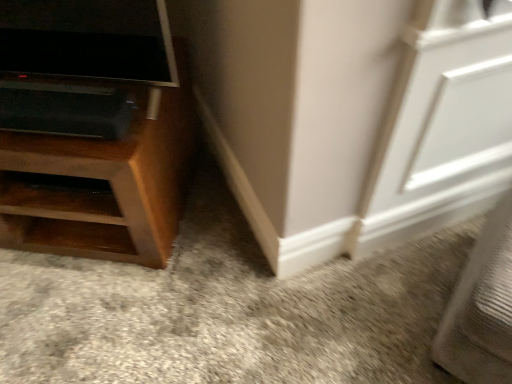
You are a GUI agent. You are given a task and a screenshot of the screen. Output one action in this format:
    pyautogui.click(x=<x>, y=<y>)
    Task: Click on the white matte screen door at upper right
    The height and width of the screenshot is (384, 512).
    Given the screenshot: What is the action you would take?
    pyautogui.click(x=442, y=126)

This screenshot has height=384, width=512. What do you see at coordinates (442, 126) in the screenshot? I see `white matte screen door at upper right` at bounding box center [442, 126].

This screenshot has width=512, height=384. What do you see at coordinates (103, 183) in the screenshot?
I see `wooden cabinet at left` at bounding box center [103, 183].

From the picture: Measure the distance between point (19, 133) and camera.

Point (19, 133) and camera are 3.48 feet apart from each other.

You are a GUI agent. You are given a task and a screenshot of the screen. Output one action in this format:
    pyautogui.click(x=<x>, y=<y>)
    Task: Click on the wooden cabinet at left
    This screenshot has height=384, width=512.
    Given the screenshot: What is the action you would take?
    pyautogui.click(x=103, y=183)

Identify the location of white matte screen door at upper right. The width and height of the screenshot is (512, 384). (442, 126).

Considering the relative positions of wooden cabinet at left and white matte screen door at upper right in the image provided, is wooden cabinet at left to the left of white matte screen door at upper right from the viewer's perspective?

Indeed, wooden cabinet at left is positioned on the left side of white matte screen door at upper right.

Is wooden cabinet at left in front of white matte screen door at upper right?

No, it is not.

Which is behind, point (143, 115) or point (422, 171)?

Positioned behind is point (422, 171).

From the image's perspective, is wooden cabinet at left located above or below white matte screen door at upper right?

wooden cabinet at left is situated higher than white matte screen door at upper right in the image.

From a real-world perspective, which is physically below, wooden cabinet at left or white matte screen door at upper right?

In real-world perspective, wooden cabinet at left is lower.

In terms of width, does wooden cabinet at left look wider or thinner when compared to white matte screen door at upper right?

Considering their sizes, wooden cabinet at left looks broader than white matte screen door at upper right.

Which of these two, wooden cabinet at left or white matte screen door at upper right, stands shorter?

Standing shorter between the two is wooden cabinet at left.

Who is bigger, wooden cabinet at left or white matte screen door at upper right?

With larger size is wooden cabinet at left.

Is white matte screen door at upper right a part of wooden cabinet at left?

No.

Is wooden cabinet at left far away from white matte screen door at upper right?

No, wooden cabinet at left is not far away from white matte screen door at upper right.

Consider the image. Does wooden cabinet at left turn towards white matte screen door at upper right?

No, wooden cabinet at left is not turned towards white matte screen door at upper right.

Where is `screen door on the right of wooden cabinet at left`? The image size is (512, 384). screen door on the right of wooden cabinet at left is located at coordinates (442, 126).

Which object is positioned more to the left, white matte screen door at upper right or wooden cabinet at left?

wooden cabinet at left is more to the left.

Is the depth of white matte screen door at upper right less than that of wooden cabinet at left?

Yes, white matte screen door at upper right is closer to the camera.

Considering the positions of point (392, 101) and point (49, 237), is point (392, 101) closer or farther from the camera than point (49, 237)?

Point (392, 101) appears to be closer to the viewer than point (49, 237).

In the scene shown: From the image's perspective, is white matte screen door at upper right on top of wooden cabinet at left?

No, from the image's perspective, white matte screen door at upper right is not above wooden cabinet at left.

From a real-world perspective, is white matte screen door at upper right physically located above or below wooden cabinet at left?

From a real-world perspective, white matte screen door at upper right is physically above wooden cabinet at left.

Between white matte screen door at upper right and wooden cabinet at left, which one has smaller width?

With smaller width is white matte screen door at upper right.

Between white matte screen door at upper right and wooden cabinet at left, which one has more height?

Standing taller between the two is white matte screen door at upper right.

Is white matte screen door at upper right smaller than wooden cabinet at left?

Correct, white matte screen door at upper right occupies less space than wooden cabinet at left.

Is wooden cabinet at left a part of white matte screen door at upper right?

Definitely not — wooden cabinet at left is not inside white matte screen door at upper right.

Is white matte screen door at upper right far from wooden cabinet at left?

That's not correct — white matte screen door at upper right is a little close to wooden cabinet at left.

Does white matte screen door at upper right turn towards wooden cabinet at left?

No, white matte screen door at upper right is not facing towards wooden cabinet at left.

From the picture: How distant is white matte screen door at upper right from wooden cabinet at left?

white matte screen door at upper right is 31.30 inches from wooden cabinet at left.

The height and width of the screenshot is (384, 512). Find the location of `furniture located underneath the white matte screen door at upper right (from a real-world perspective)`. furniture located underneath the white matte screen door at upper right (from a real-world perspective) is located at coordinates (103, 183).

This screenshot has width=512, height=384. What are the coordinates of `screen door that is on the right side of wooden cabinet at left` in the screenshot? It's located at (442, 126).

In the image, there is a wooden cabinet at left. Identify the location of screen door below it (from the image's perspective). (442, 126).